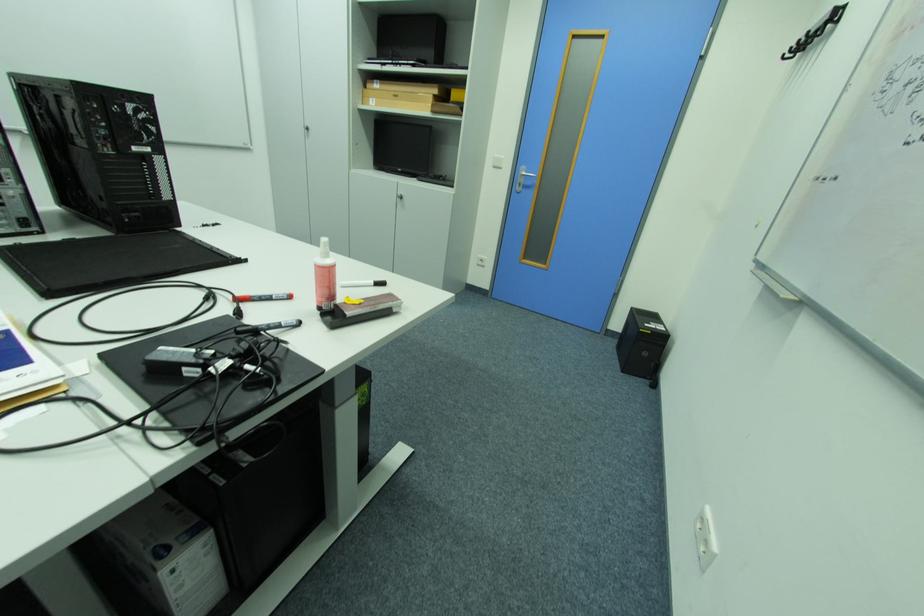
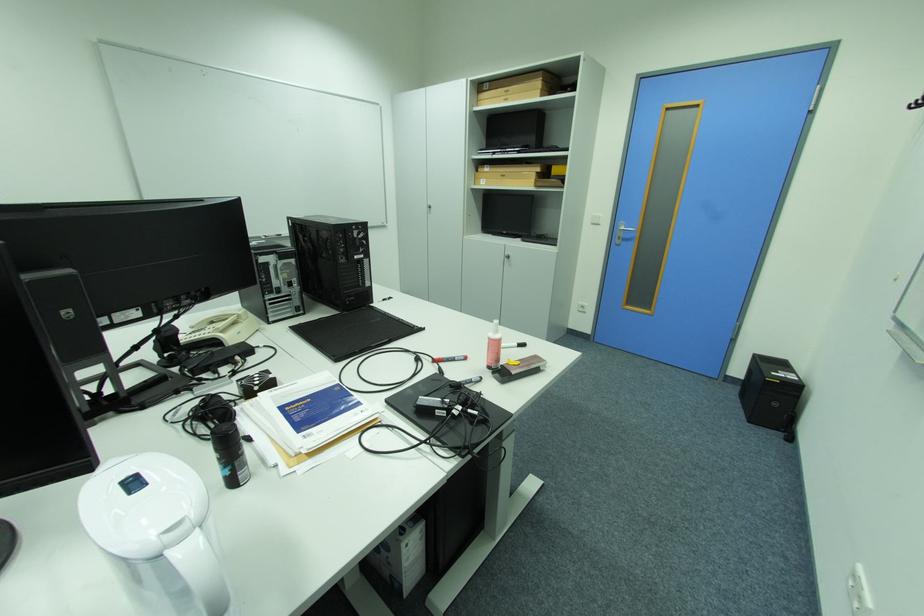
Find the pixel in the second image that matches pixel 246 301 in the first image.

(443, 362)